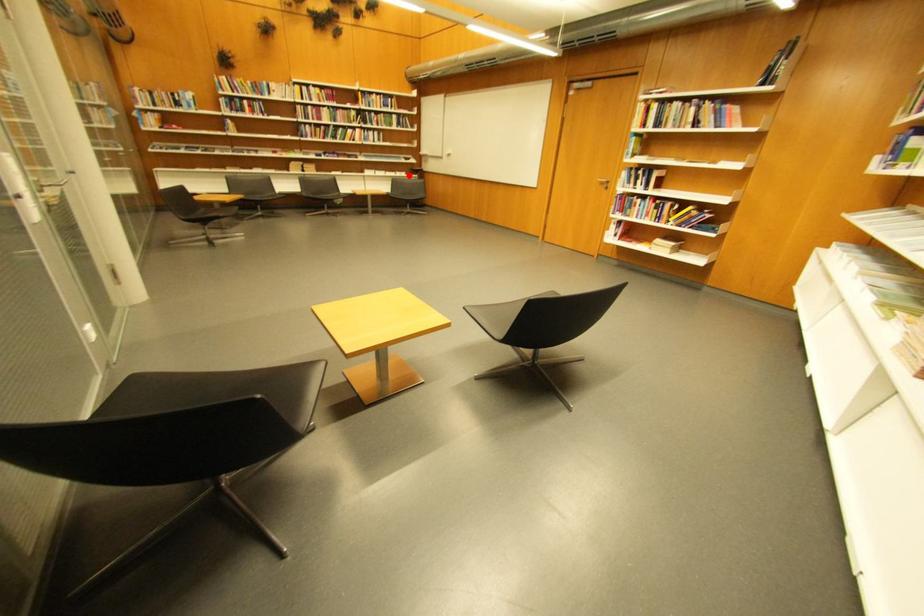
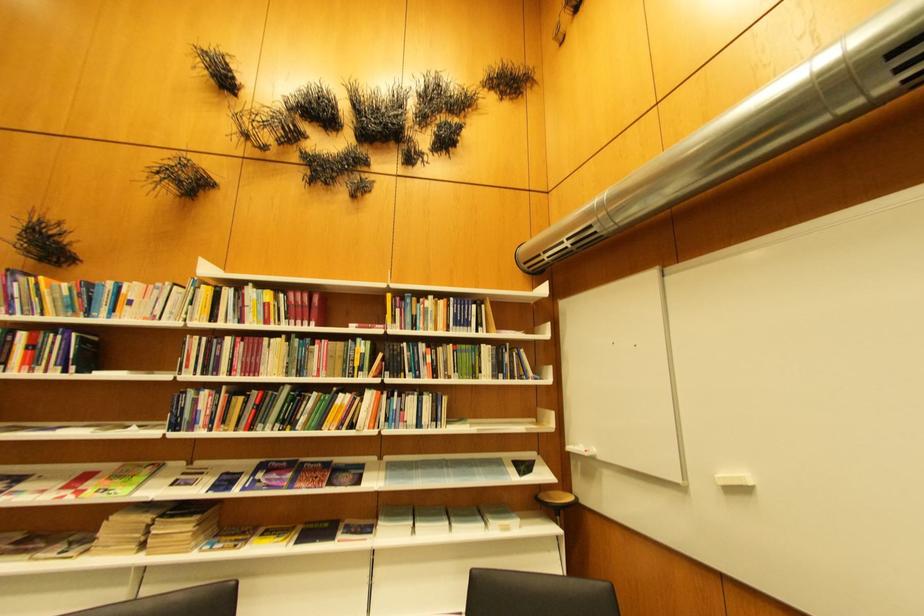
In the second image, find the point that corresponds to the highlighted location in the first image.

(506, 530)